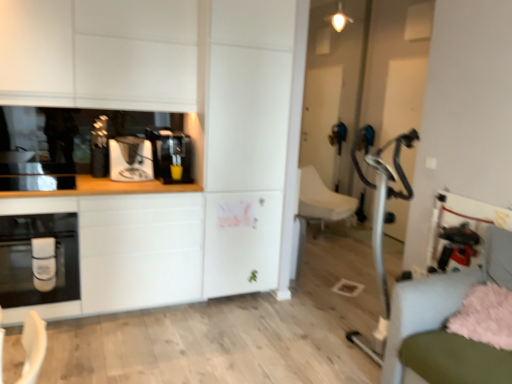
Question: Considering the relative sizes of fluffy pink pillow at lower right and white fabric swivel chair at center, positioned as the first swivel chair in back-to-front order, in the image provided, is fluffy pink pillow at lower right thinner than white fabric swivel chair at center, positioned as the first swivel chair in back-to-front order,?

Choices:
 (A) no
 (B) yes

Answer: (B)

Question: Is fluffy pink pillow at lower right placed right next to white fabric swivel chair at center, placed as the 2th swivel chair when sorted from front to back?

Choices:
 (A) no
 (B) yes

Answer: (A)

Question: Can you confirm if fluffy pink pillow at lower right is bigger than white fabric swivel chair at center, positioned as the first swivel chair in back-to-front order?

Choices:
 (A) no
 (B) yes

Answer: (A)

Question: From a real-world perspective, is fluffy pink pillow at lower right over white fabric swivel chair at center, positioned as the first swivel chair in back-to-front order?

Choices:
 (A) no
 (B) yes

Answer: (B)

Question: Does fluffy pink pillow at lower right have a greater width compared to white fabric swivel chair at center, positioned as the first swivel chair in back-to-front order?

Choices:
 (A) yes
 (B) no

Answer: (B)

Question: Is point [244, 251] positioned closer to the camera than point [19, 187]?

Choices:
 (A) farther
 (B) closer

Answer: (A)

Question: Considering the positions of white matte countertop at left and black glossy toaster at left in the image, is white matte countertop at left wider or thinner than black glossy toaster at left?

Choices:
 (A) wide
 (B) thin

Answer: (A)

Question: In terms of size, does white matte countertop at left appear bigger or smaller than black glossy toaster at left?

Choices:
 (A) small
 (B) big

Answer: (B)

Question: Which is correct: white matte countertop at left is inside black glossy toaster at left, or outside of it?

Choices:
 (A) outside
 (B) inside

Answer: (A)

Question: In terms of height, does white matte cabinet at upper left look taller or shorter compared to black plastic coffee machine at left, the 2th coffee machine from the left?

Choices:
 (A) short
 (B) tall

Answer: (B)

Question: In the image, is white matte cabinet at upper left on the left side or the right side of black plastic coffee machine at left, the 1th coffee machine positioned from the right?

Choices:
 (A) left
 (B) right

Answer: (A)

Question: Relative to black plastic coffee machine at left, the 1th coffee machine positioned from the right, is white matte cabinet at upper left in front or behind?

Choices:
 (A) behind
 (B) front

Answer: (B)

Question: From a real-world perspective, is white matte cabinet at upper left positioned above or below black plastic coffee machine at left, the 1th coffee machine positioned from the right?

Choices:
 (A) below
 (B) above

Answer: (B)

Question: From the image's perspective, is matte black oven at left positioned above or below white matte countertop at left?

Choices:
 (A) above
 (B) below

Answer: (B)

Question: Is matte black oven at left wider or thinner than white matte countertop at left?

Choices:
 (A) thin
 (B) wide

Answer: (A)